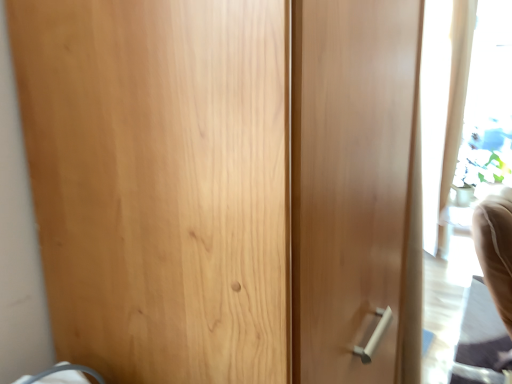
Measure the distance between white sheer curtain at right and camera.

white sheer curtain at right is 9.43 feet away from camera.

What do you see at coordinates (443, 105) in the screenshot? The width and height of the screenshot is (512, 384). I see `white sheer curtain at right` at bounding box center [443, 105].

Locate an element on the screen. white sheer curtain at right is located at coordinates (443, 105).

Locate an element on the screen. The width and height of the screenshot is (512, 384). white sheer curtain at right is located at coordinates (443, 105).